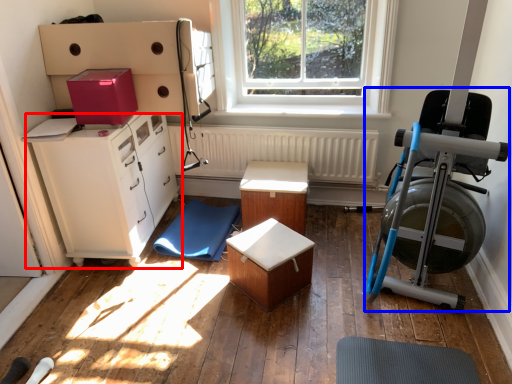
Question: Which point is further to the camera, chest of drawers (highlighted by a red box) or baby carriage (highlighted by a blue box)?

Choices:
 (A) chest of drawers
 (B) baby carriage

Answer: (A)